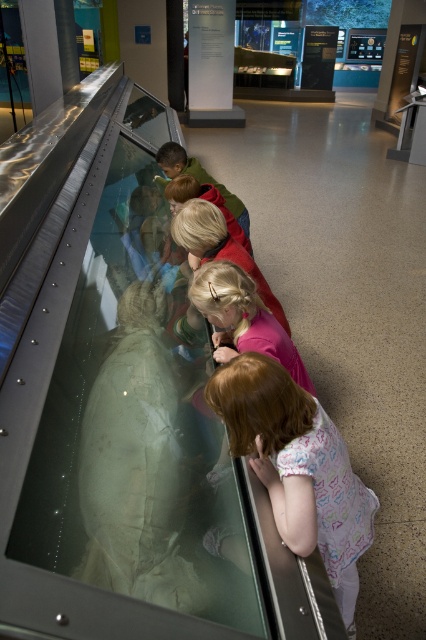
You are a tour guide in the museum and need to direct visitors to two points of interest marked as point coordinates. The first point is point (230, 422) and the second is point (210, 310). A visitor asks which point is closer to the entrance located at the front of the museum. Based on their positions, which point is closer to the entrance?

Point (230, 422) is in front of point (210, 310), so it is closer to the entrance located at the front of the museum.

From the picture: You are a photographer aiming to capture a clear shot of the light brown fabric dress at lower center without any reflections from the polished floor. Based on the scene description, where should you position yourself relative to the tank to avoid the floor reflections?

The light brown fabric dress at lower center is located at point (298, 467). To avoid floor reflections, position yourself directly above or slightly to the side of this point, ensuring the angle minimizes reflection interference.